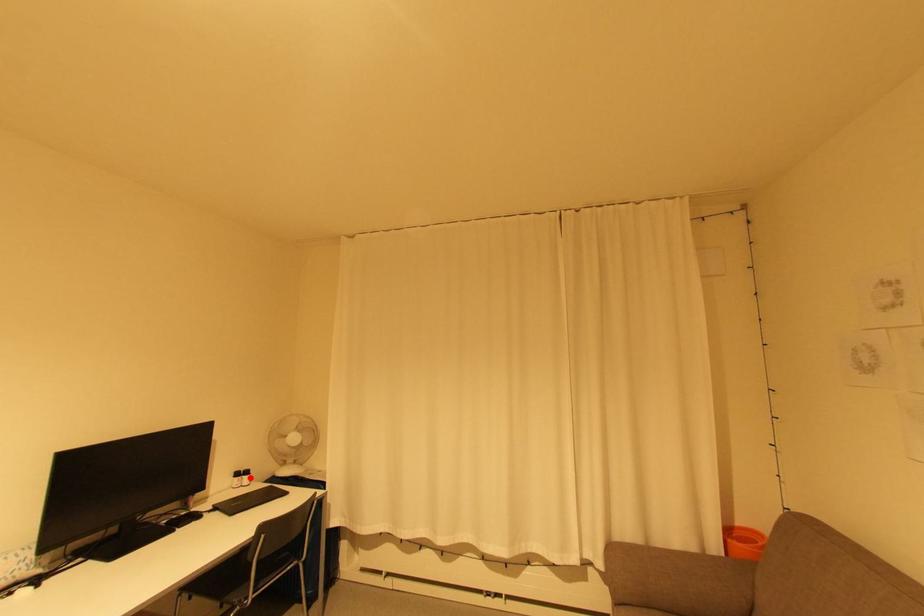
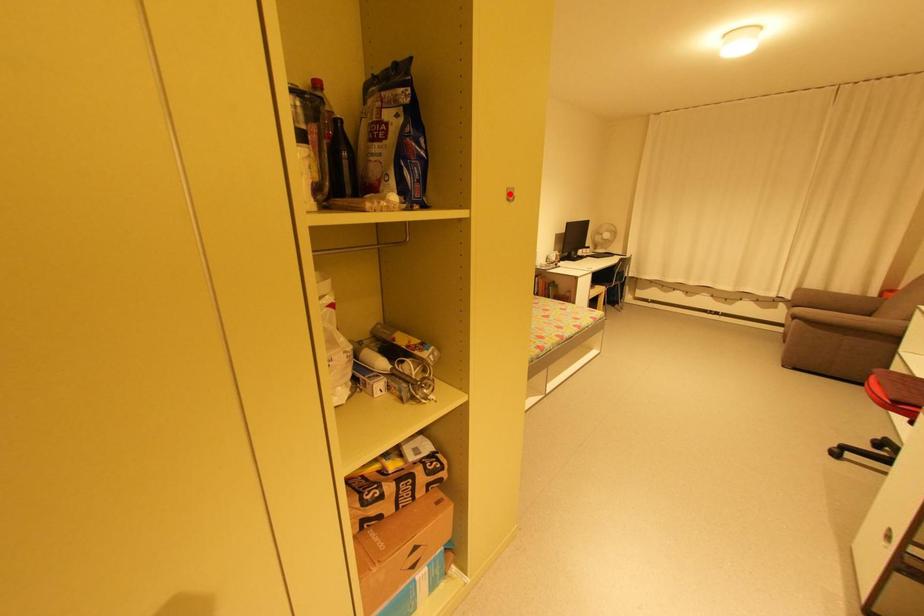
I am providing you with two images of the same scene from different viewpoints. A red point is marked on the first image and another point is marked on the second image. Do the highlighted points in image1 and image2 indicate the same real-world spot?

No